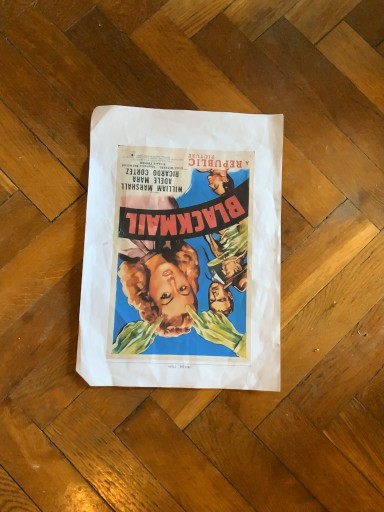
This screenshot has width=384, height=512. Find the location of `vacant area on top of matte paper poster at center (from a real-world perspective)`. vacant area on top of matte paper poster at center (from a real-world perspective) is located at coordinates (201, 241).